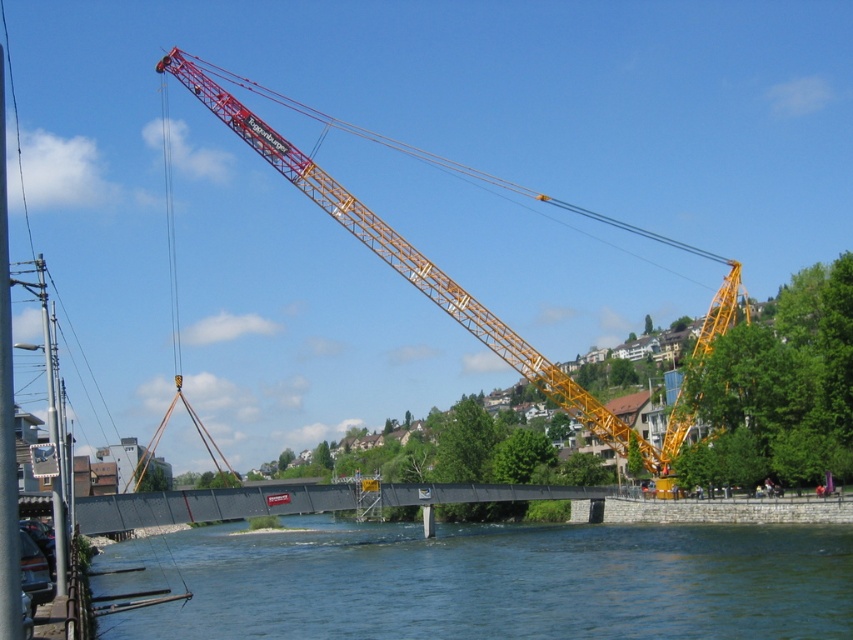
Between point (160, 545) and point (691, 422), which one is positioned in front?

Positioned in front is point (691, 422).

Can you confirm if clear blue water at lower center is positioned below red/yellow metal crane at upper center?

Yes, clear blue water at lower center is below red/yellow metal crane at upper center.

Find the location of a particular element. clear blue water at lower center is located at coordinates (489, 580).